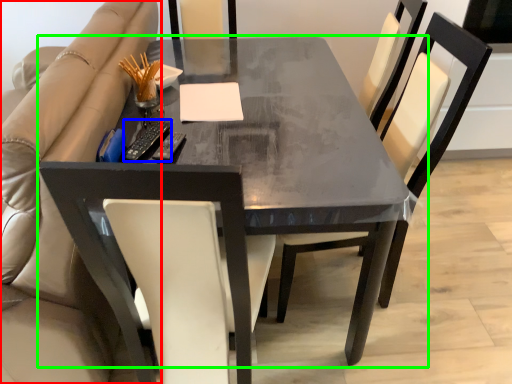
Question: Estimate the real-world distances between objects in this image. Which object is closer to beige (highlighted by a red box), remote (highlighted by a blue box) or table (highlighted by a green box)?

Choices:
 (A) remote
 (B) table

Answer: (A)